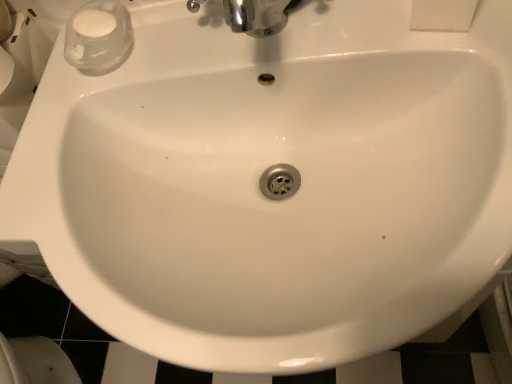
What is the approximate width of transparent glass soap at upper left?

11.16 centimeters.

What is the approximate height of transparent glass soap at upper left?

It is 1.72 inches.

The image size is (512, 384). In order to click on transparent glass soap at upper left in this screenshot , I will do `click(98, 37)`.

What do you see at coordinates (98, 37) in the screenshot? Image resolution: width=512 pixels, height=384 pixels. I see `transparent glass soap at upper left` at bounding box center [98, 37].

Measure the distance between transparent glass soap at upper left and camera.

22.53 inches.

The height and width of the screenshot is (384, 512). What are the coordinates of `transparent glass soap at upper left` in the screenshot? It's located at (98, 37).